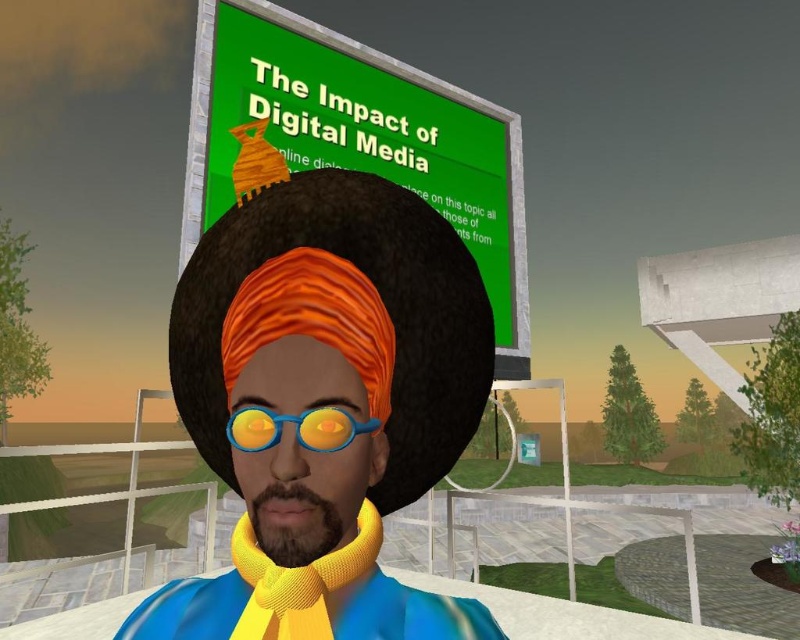
Question: Is yellow knitted scarf at center above brown fuzzy beard at center?

Choices:
 (A) yes
 (B) no

Answer: (B)

Question: Is yellow knitted scarf at center bigger than blue rubber goggles at center?

Choices:
 (A) no
 (B) yes

Answer: (B)

Question: Which object appears farthest from the camera in this image?

Choices:
 (A) yellow matte scarf at center
 (B) yellow knitted scarf at center

Answer: (B)

Question: Which object appears closest to the camera in this image?

Choices:
 (A) yellow knitted scarf at center
 (B) blue rubber goggles at center

Answer: (B)

Question: Which point appears closest to the camera in this image?

Choices:
 (A) (293, 499)
 (B) (237, 589)

Answer: (A)

Question: Is yellow matte scarf at center further to the viewer compared to yellow knitted scarf at center?

Choices:
 (A) no
 (B) yes

Answer: (A)